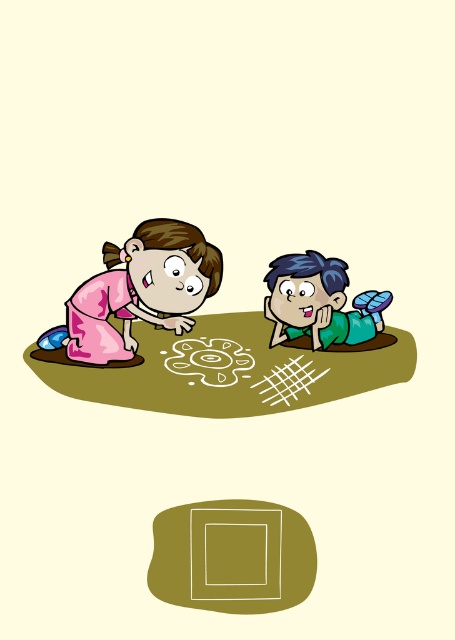
Question: Which object is positioned farthest from the green matte shirt at center?

Choices:
 (A) pink fabric dress at left
 (B) white chalk drawing at center

Answer: (A)

Question: Where is smooth olive square at center located in relation to green matte shirt at center in the image?

Choices:
 (A) below
 (B) above

Answer: (A)

Question: Does smooth olive square at center have a smaller size compared to green matte shirt at center?

Choices:
 (A) yes
 (B) no

Answer: (B)

Question: Which point is closer to the camera?

Choices:
 (A) smooth olive square at center
 (B) green matte shirt at center
 (C) pink fabric dress at left

Answer: (A)

Question: Is green matte shirt at center positioned in front of white chalk drawing at center?

Choices:
 (A) yes
 (B) no

Answer: (B)

Question: Which object is farther from the camera taking this photo?

Choices:
 (A) green matte shirt at center
 (B) pink fabric dress at left
 (C) smooth olive square at center

Answer: (A)